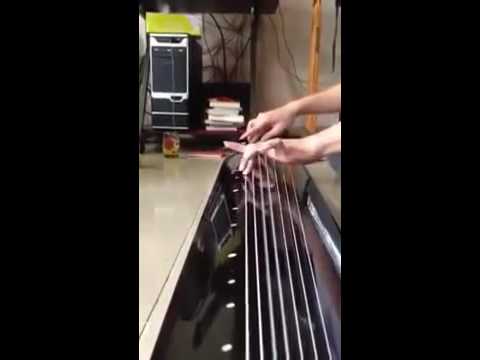
The image size is (480, 360). Find the location of `wall`. wall is located at coordinates (274, 78), (210, 33).